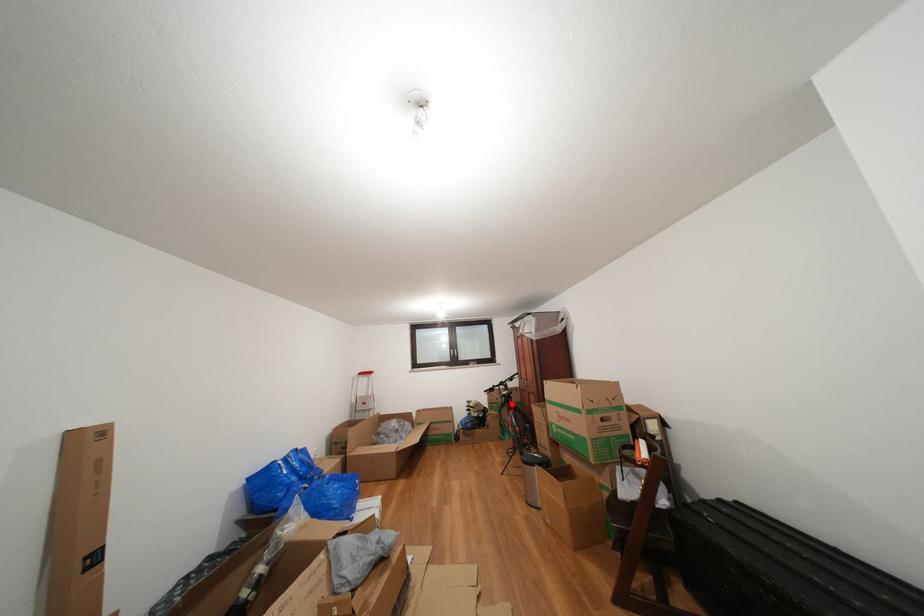
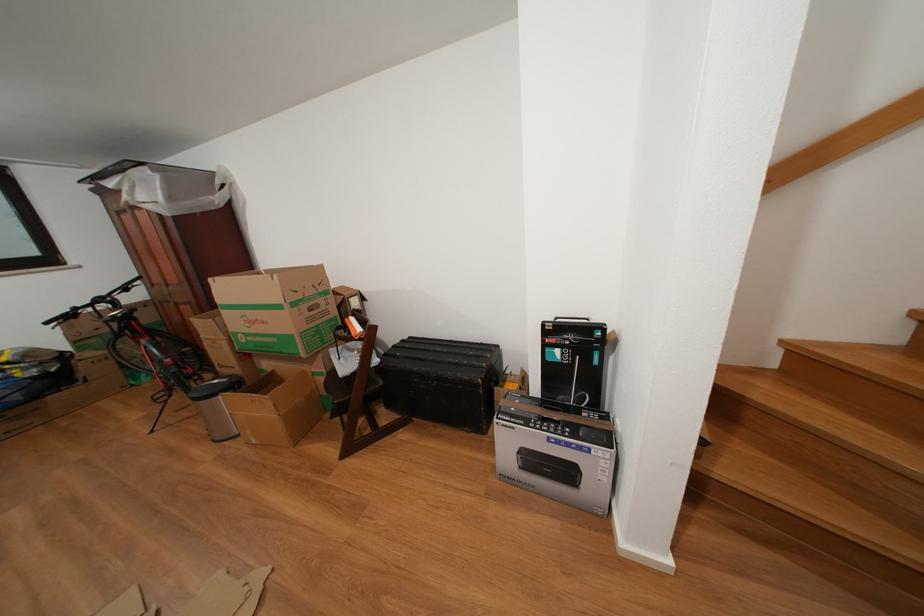
Question: I am providing you with two images of the same scene from different viewpoints. Image1 has a red point marked. In image2, the corresponding 3D location appears at what relative position? Reply with the corresponding letter.

Choices:
 (A) Closer
 (B) Farther

Answer: (A)